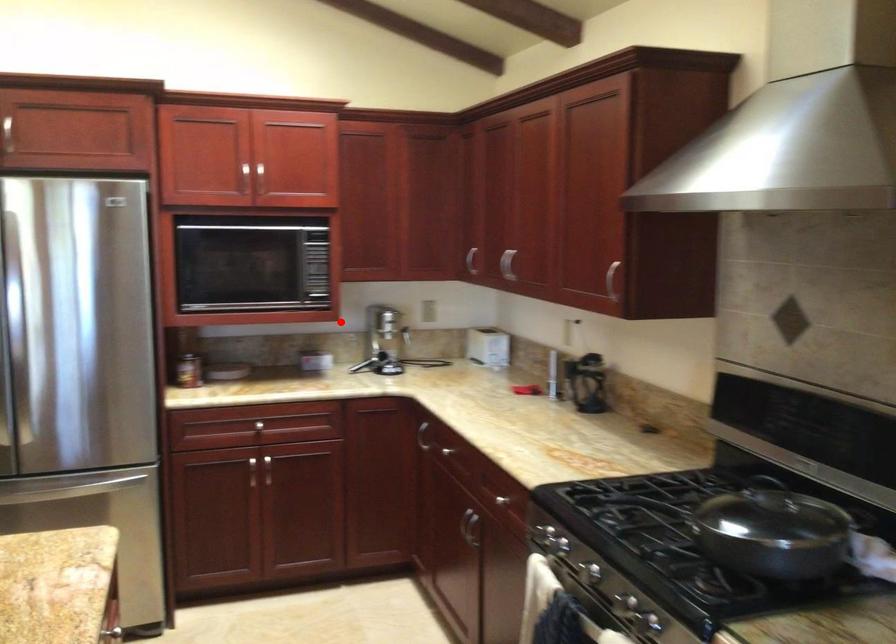
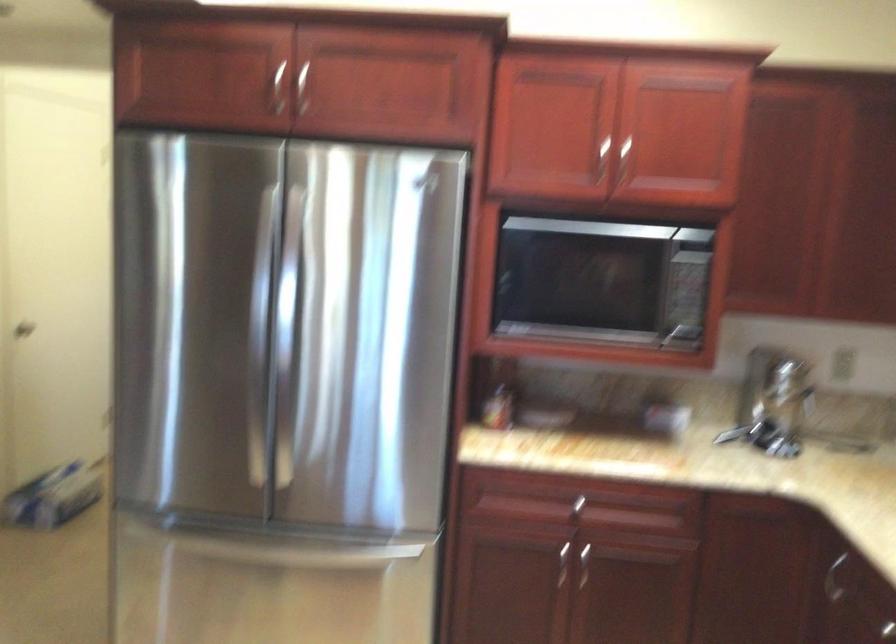
Question: I am providing you with two images of the same scene from different viewpoints. A red point is marked on the first image. Is the red point's position out of view in image 2?

Choices:
 (A) Yes
 (B) No

Answer: (A)